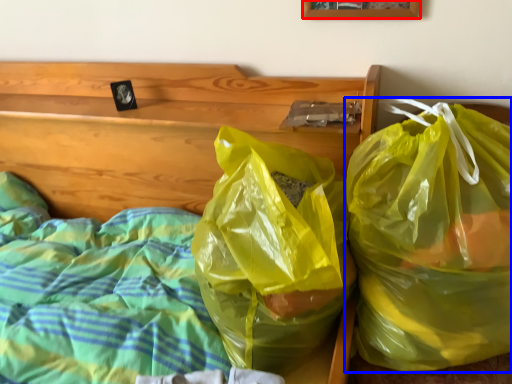
Question: Which of the following is the farthest to the observer, picture frame (highlighted by a red box) or plastic bag (highlighted by a blue box)?

Choices:
 (A) picture frame
 (B) plastic bag

Answer: (A)